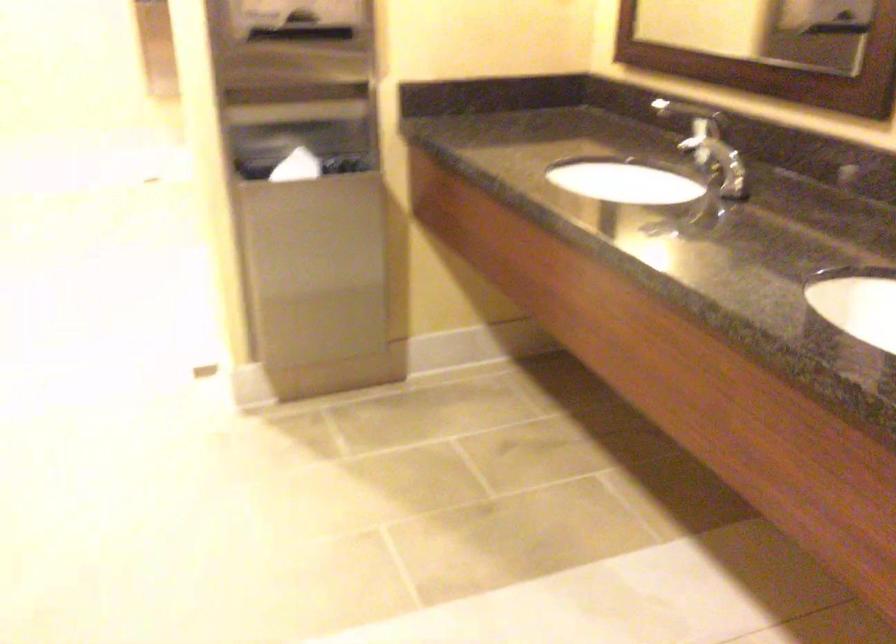
The width and height of the screenshot is (896, 644). Describe the element at coordinates (717, 156) in the screenshot. I see `the faucet handle` at that location.